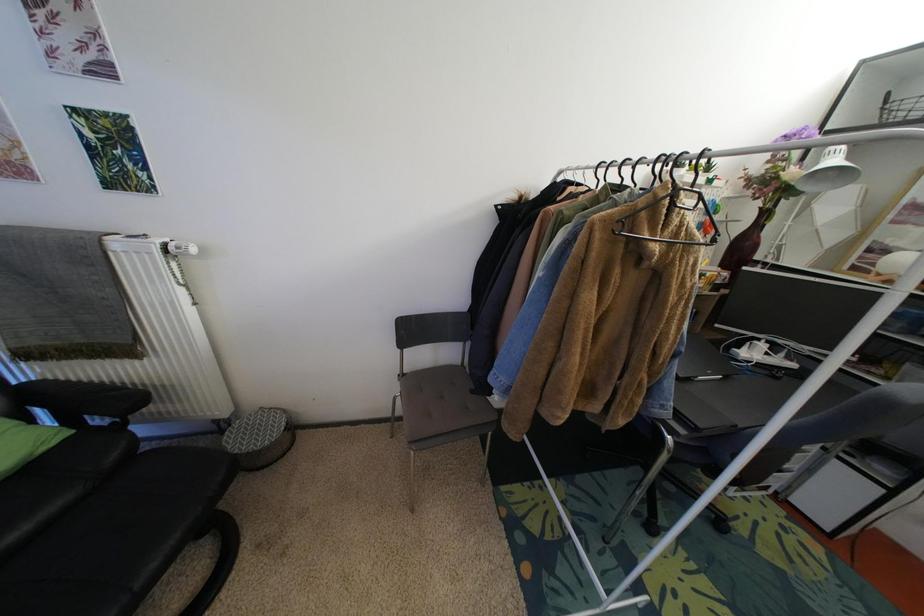
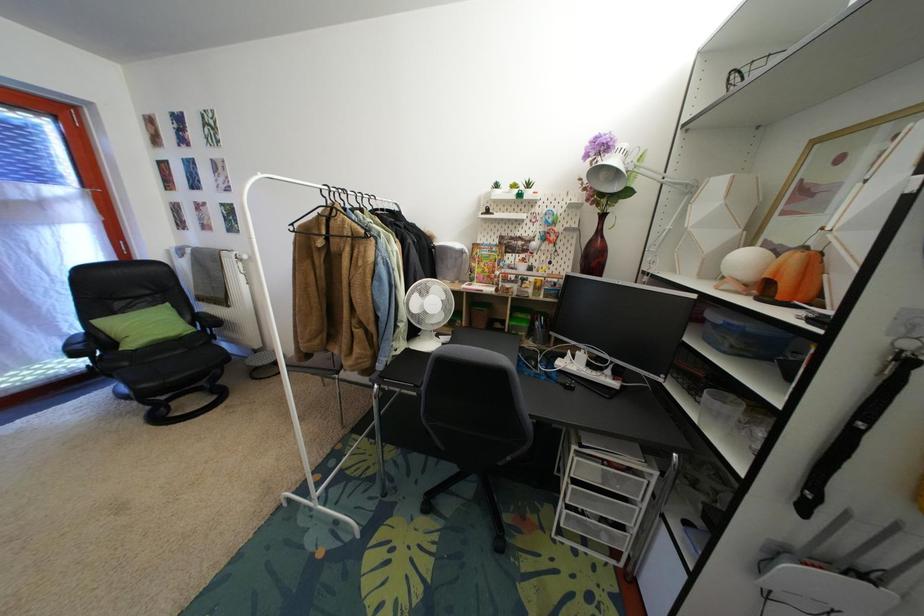
Question: The images are taken continuously from a first-person perspective. In which direction are you moving?

Choices:
 (A) Left
 (B) Right
 (C) Forward
 (D) Backward

Answer: (B)